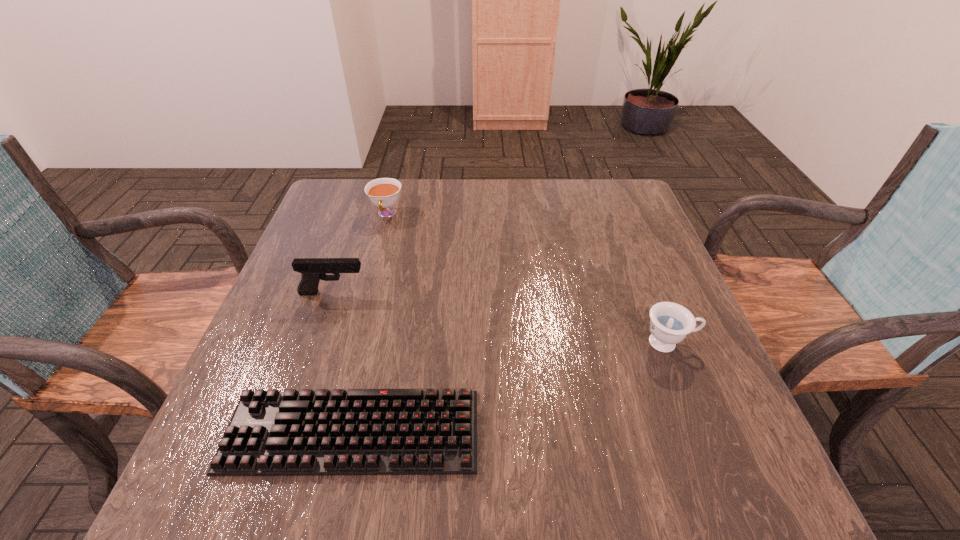
Locate an element on the screen. vacant space that is in between the farther teacup and the tallest object is located at coordinates (360, 254).

Locate an element on the screen. free space between the left teacup and the pistol is located at coordinates (360, 254).

Where is `free area in between the rightmost object and the pistol`? The width and height of the screenshot is (960, 540). free area in between the rightmost object and the pistol is located at coordinates (501, 318).

Where is `vacant space that is in between the second farthest object and the rightmost object`? The height and width of the screenshot is (540, 960). vacant space that is in between the second farthest object and the rightmost object is located at coordinates (501, 318).

You are a GUI agent. You are given a task and a screenshot of the screen. Output one action in this format:
    pyautogui.click(x=<x>, y=<y>)
    Task: Click on the free area in between the second farthest object and the computer keyboard
    
    Given the screenshot: What is the action you would take?
    coord(343,362)

What are the coordinates of `object that is the third closest to the nearest object` in the screenshot? It's located at (383, 192).

Identify which object is located as the second nearest to the farther teacup. Please provide its 2D coordinates. Your answer should be formatted as a tuple, i.e. [(x, y)], where the tuple contains the x and y coordinates of a point satisfying the conditions above.

[(360, 431)]

Locate an element on the screen. The width and height of the screenshot is (960, 540). vacant position in the image that satisfies the following two spatial constraints: 1. on the side of the nearest object with the handle; 2. on the right side of the left teacup is located at coordinates (329, 432).

Identify the location of free space that satisfies the following two spatial constraints: 1. on the side of the computer keyboard with the handle; 2. on the left side of the farthest object. This screenshot has height=540, width=960. point(329,432).

Locate an element on the screen. free spot that satisfies the following two spatial constraints: 1. on the back side of the computer keyboard; 2. on the front-facing side of the third nearest object is located at coordinates tap(384, 293).